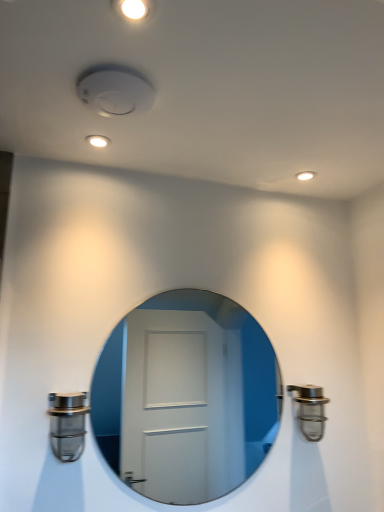
Question: Is white glossy mirror at center inside or outside of satin nickel faucet at right, the second door handle in the front-to-back sequence?

Choices:
 (A) outside
 (B) inside

Answer: (A)

Question: Considering the positions of point (97, 382) and point (319, 406), is point (97, 382) closer or farther from the camera than point (319, 406)?

Choices:
 (A) farther
 (B) closer

Answer: (A)

Question: Which object is positioned farthest from the satin nickel door handle at lower left, arranged as the 2th door handle when viewed from the back?

Choices:
 (A) white glossy mirror at center
 (B) satin nickel faucet at right, the second door handle positioned from the left

Answer: (A)

Question: Based on their relative distances, which object is farther from the satin nickel faucet at right, the second door handle positioned from the left?

Choices:
 (A) satin nickel door handle at lower left, arranged as the 2th door handle when viewed from the back
 (B) white glossy mirror at center

Answer: (B)